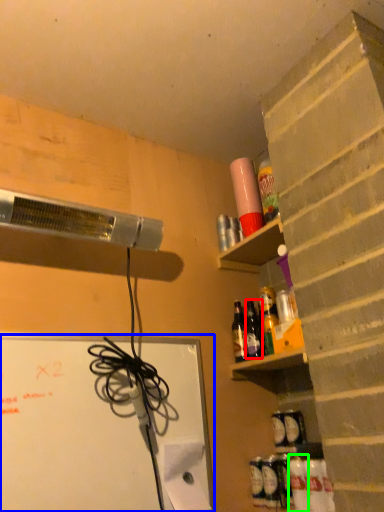
Question: Estimate the real-world distances between objects in this image. Which object is closer to bottle (highlighted by a red box), bulletin board (highlighted by a blue box) or bottle (highlighted by a green box)?

Choices:
 (A) bulletin board
 (B) bottle

Answer: (B)